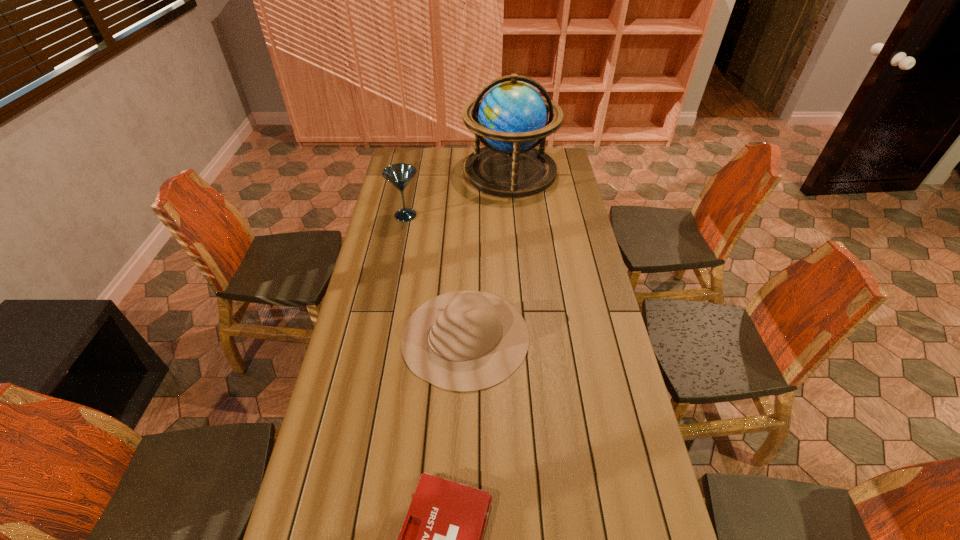
Find the location of a particular element. The height and width of the screenshot is (540, 960). globe is located at coordinates (512, 116).

Where is `the farthest object`? The height and width of the screenshot is (540, 960). the farthest object is located at coordinates (512, 116).

Find the location of `the third nearest object`. the third nearest object is located at coordinates (399, 175).

In order to click on martini in this screenshot , I will do `click(399, 175)`.

Locate an element on the screen. This screenshot has height=540, width=960. sombrero is located at coordinates (463, 341).

Identify the location of the third tallest object. This screenshot has height=540, width=960. (463, 341).

You are a GUI agent. You are given a task and a screenshot of the screen. Output one action in this format:
    pyautogui.click(x=<x>, y=<y>)
    Task: Click on the vacant space located 0.190m on the left of the farthest object
    
    Given the screenshot: What is the action you would take?
    pyautogui.click(x=426, y=171)

Locate an element on the screen. blank space located 0.320m on the right of the martini is located at coordinates (493, 215).

The width and height of the screenshot is (960, 540). I want to click on vacant space located 0.240m on the right of the sombrero, so click(600, 337).

Where is `object situated at the far edge`? This screenshot has height=540, width=960. object situated at the far edge is located at coordinates tap(512, 116).